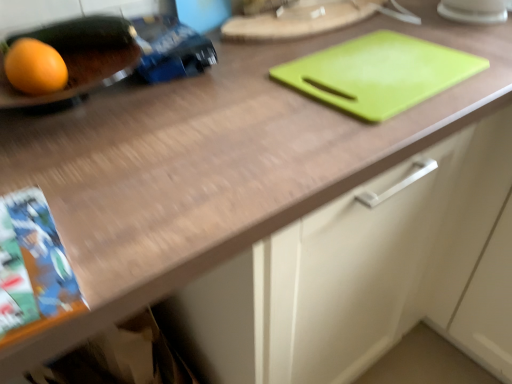
Find the location of `matte black tray at left, arranged as the first tray when viewed from the left`. matte black tray at left, arranged as the first tray when viewed from the left is located at coordinates (79, 57).

Where is `green plastic cutting board at upper center, which appears as the 2th tray when viewed from the right`? green plastic cutting board at upper center, which appears as the 2th tray when viewed from the right is located at coordinates (298, 20).

Is orange matte grapefruit at left wider than green plastic cutting board at upper center, the second tray from the left?

Incorrect, the width of orange matte grapefruit at left does not surpass that of green plastic cutting board at upper center, the second tray from the left.

Is point (39, 70) closer to camera compared to point (317, 7)?

Yes, it is in front of point (317, 7).

Is orange matte grapefruit at left not inside green plastic cutting board at upper center, the second tray from the left?

Absolutely, orange matte grapefruit at left is external to green plastic cutting board at upper center, the second tray from the left.

Could you tell me if orange matte grapefruit at left is facing green plastic cutting board at upper center, which appears as the 2th tray when viewed from the right?

No, orange matte grapefruit at left is not turned towards green plastic cutting board at upper center, which appears as the 2th tray when viewed from the right.

From the image's perspective, who appears lower, matte black tray at left, arranged as the first tray when viewed from the left, or orange matte grapefruit at left?

orange matte grapefruit at left, from the image's perspective.

Could you tell me if matte black tray at left, the 3th tray when ordered from right to left, is facing orange matte grapefruit at left?

Yes, matte black tray at left, the 3th tray when ordered from right to left, is turned towards orange matte grapefruit at left.

Can you confirm if matte black tray at left, arranged as the first tray when viewed from the left, is positioned to the right of orange matte grapefruit at left?

Indeed, matte black tray at left, arranged as the first tray when viewed from the left, is positioned on the right side of orange matte grapefruit at left.

Is green plastic cutting board at upper center, which appears as the 2th tray when viewed from the right, bigger or smaller than orange matte grapefruit at left?

Clearly, green plastic cutting board at upper center, which appears as the 2th tray when viewed from the right, is larger in size than orange matte grapefruit at left.

Can you tell me how much green plastic cutting board at upper center, which appears as the 2th tray when viewed from the right, and orange matte grapefruit at left differ in facing direction?

green plastic cutting board at upper center, which appears as the 2th tray when viewed from the right, and orange matte grapefruit at left are facing 0.000807 degrees away from each other.

The image size is (512, 384). In order to click on tray that is the 1st one below the orange matte grapefruit at left (from a real-world perspective) in this screenshot , I will do `click(298, 20)`.

Which is behind, green plastic cutting board at upper center, which appears as the 2th tray when viewed from the right, or orange matte grapefruit at left?

Answer: green plastic cutting board at upper center, which appears as the 2th tray when viewed from the right.

From the image's perspective, which is below, matte black tray at left, the 3th tray when ordered from right to left, or green plastic cutting board at upper right, the 3th tray in the left-to-right sequence?

green plastic cutting board at upper right, the 3th tray in the left-to-right sequence, appears lower in the image.

Which of these two, matte black tray at left, the 3th tray when ordered from right to left, or green plastic cutting board at upper right, the 3th tray in the left-to-right sequence, is wider?

With larger width is green plastic cutting board at upper right, the 3th tray in the left-to-right sequence.

In the scene shown: Would you say matte black tray at left, the 3th tray when ordered from right to left, is a long distance from green plastic cutting board at upper right, the 3th tray in the left-to-right sequence?

No, matte black tray at left, the 3th tray when ordered from right to left, is not far away from green plastic cutting board at upper right, the 3th tray in the left-to-right sequence.

This screenshot has width=512, height=384. I want to click on the 1st tray in front of the green plastic cutting board at upper center, which appears as the 2th tray when viewed from the right, so click(379, 73).

From a real-world perspective, which is physically above, green plastic cutting board at upper center, the second tray from the left, or green plastic cutting board at upper right, which appears as the first tray when viewed from the right?

In real-world perspective, green plastic cutting board at upper center, the second tray from the left, is above.

How many degrees apart are the facing directions of green plastic cutting board at upper center, which appears as the 2th tray when viewed from the right, and green plastic cutting board at upper right, the 3th tray in the left-to-right sequence?

1.08 degrees separate the facing orientations of green plastic cutting board at upper center, which appears as the 2th tray when viewed from the right, and green plastic cutting board at upper right, the 3th tray in the left-to-right sequence.

From the image's perspective, is green plastic cutting board at upper center, the second tray from the left, below green plastic cutting board at upper right, which appears as the first tray when viewed from the right?

Incorrect, from the image's perspective, green plastic cutting board at upper center, the second tray from the left, is higher than green plastic cutting board at upper right, which appears as the first tray when viewed from the right.

From a real-world perspective, who is located lower, orange matte grapefruit at left or matte black tray at left, the 3th tray when ordered from right to left?

orange matte grapefruit at left.

How distant is orange matte grapefruit at left from matte black tray at left, the 3th tray when ordered from right to left?

2.51 inches.

Would you say orange matte grapefruit at left contains matte black tray at left, the 3th tray when ordered from right to left?

No, orange matte grapefruit at left does not contain matte black tray at left, the 3th tray when ordered from right to left.

Who is smaller, matte black tray at left, the 3th tray when ordered from right to left, or green plastic cutting board at upper center, which appears as the 2th tray when viewed from the right?

Smaller between the two is matte black tray at left, the 3th tray when ordered from right to left.

Based on the photo, is matte black tray at left, the 3th tray when ordered from right to left, outside of green plastic cutting board at upper center, the second tray from the left?

Indeed, matte black tray at left, the 3th tray when ordered from right to left, is completely outside green plastic cutting board at upper center, the second tray from the left.

Is matte black tray at left, the 3th tray when ordered from right to left, in front of or behind green plastic cutting board at upper center, which appears as the 2th tray when viewed from the right, in the image?

matte black tray at left, the 3th tray when ordered from right to left, is positioned closer to the viewer than green plastic cutting board at upper center, which appears as the 2th tray when viewed from the right.

From their relative heights in the image, would you say matte black tray at left, arranged as the first tray when viewed from the left, is taller or shorter than green plastic cutting board at upper center, which appears as the 2th tray when viewed from the right?

Clearly, matte black tray at left, arranged as the first tray when viewed from the left, is taller compared to green plastic cutting board at upper center, which appears as the 2th tray when viewed from the right.

Image resolution: width=512 pixels, height=384 pixels. Identify the location of grapefruit that appears in front of the green plastic cutting board at upper center, the second tray from the left. (35, 67).

At what (x,y) coordinates should I click in order to perform the action: click on grapefruit located below the matte black tray at left, arranged as the first tray when viewed from the left (from the image's perspective). Please return your answer as a coordinate pair (x, y). This screenshot has width=512, height=384. Looking at the image, I should click on (35, 67).

Based on their spatial positions, is orange matte grapefruit at left or matte black tray at left, the 3th tray when ordered from right to left, closer to green plastic cutting board at upper center, which appears as the 2th tray when viewed from the right?

matte black tray at left, the 3th tray when ordered from right to left, lies closer to green plastic cutting board at upper center, which appears as the 2th tray when viewed from the right, than the other object.

Considering their positions, is green plastic cutting board at upper center, the second tray from the left, positioned further to matte black tray at left, the 3th tray when ordered from right to left, than green plastic cutting board at upper right, which appears as the first tray when viewed from the right?

Based on the image, green plastic cutting board at upper right, which appears as the first tray when viewed from the right, appears to be further to matte black tray at left, the 3th tray when ordered from right to left.

Looking at the image, which one is located further to orange matte grapefruit at left, green plastic cutting board at upper right, the 3th tray in the left-to-right sequence, or green plastic cutting board at upper center, which appears as the 2th tray when viewed from the right?

The object further to orange matte grapefruit at left is green plastic cutting board at upper center, which appears as the 2th tray when viewed from the right.

Looking at the image, which one is located further to green plastic cutting board at upper right, the 3th tray in the left-to-right sequence, green plastic cutting board at upper center, the second tray from the left, or matte black tray at left, arranged as the first tray when viewed from the left?

Among the two, matte black tray at left, arranged as the first tray when viewed from the left, is located further to green plastic cutting board at upper right, the 3th tray in the left-to-right sequence.

Considering their positions, is green plastic cutting board at upper right, the 3th tray in the left-to-right sequence, positioned closer to orange matte grapefruit at left than matte black tray at left, arranged as the first tray when viewed from the left?

The object closer to orange matte grapefruit at left is matte black tray at left, arranged as the first tray when viewed from the left.

When comparing their distances from green plastic cutting board at upper center, the second tray from the left, does green plastic cutting board at upper right, which appears as the first tray when viewed from the right, or matte black tray at left, arranged as the first tray when viewed from the left, seem further?

matte black tray at left, arranged as the first tray when viewed from the left, lies further to green plastic cutting board at upper center, the second tray from the left, than the other object.

Estimate the real-world distances between objects in this image. Which object is further from matte black tray at left, arranged as the first tray when viewed from the left, green plastic cutting board at upper right, which appears as the first tray when viewed from the right, or orange matte grapefruit at left?

green plastic cutting board at upper right, which appears as the first tray when viewed from the right, is positioned further to the anchor matte black tray at left, arranged as the first tray when viewed from the left.

When comparing their distances from matte black tray at left, the 3th tray when ordered from right to left, does green plastic cutting board at upper center, which appears as the 2th tray when viewed from the right, or orange matte grapefruit at left seem further?

Among the two, green plastic cutting board at upper center, which appears as the 2th tray when viewed from the right, is located further to matte black tray at left, the 3th tray when ordered from right to left.

I want to click on tray between matte black tray at left, the 3th tray when ordered from right to left, and green plastic cutting board at upper right, the 3th tray in the left-to-right sequence, in the horizontal direction, so click(298, 20).

Locate an element on the screen. tray between orange matte grapefruit at left and green plastic cutting board at upper center, which appears as the 2th tray when viewed from the right, in the horizontal direction is located at coordinates (79, 57).